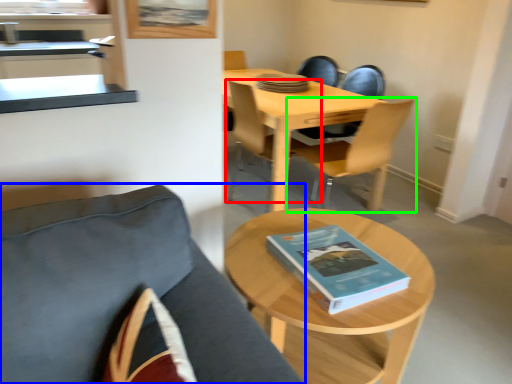
Question: Which object is positioned closest to chair (highlighted by a red box)? Select from chair (highlighted by a blue box) and chair (highlighted by a green box).

Choices:
 (A) chair
 (B) chair

Answer: (B)